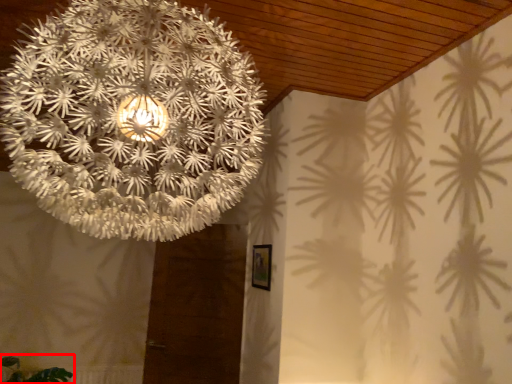
Question: Observing the image, what is the correct spatial positioning of plant (annotated by the red box) in reference to lamp?

Choices:
 (A) left
 (B) right

Answer: (A)